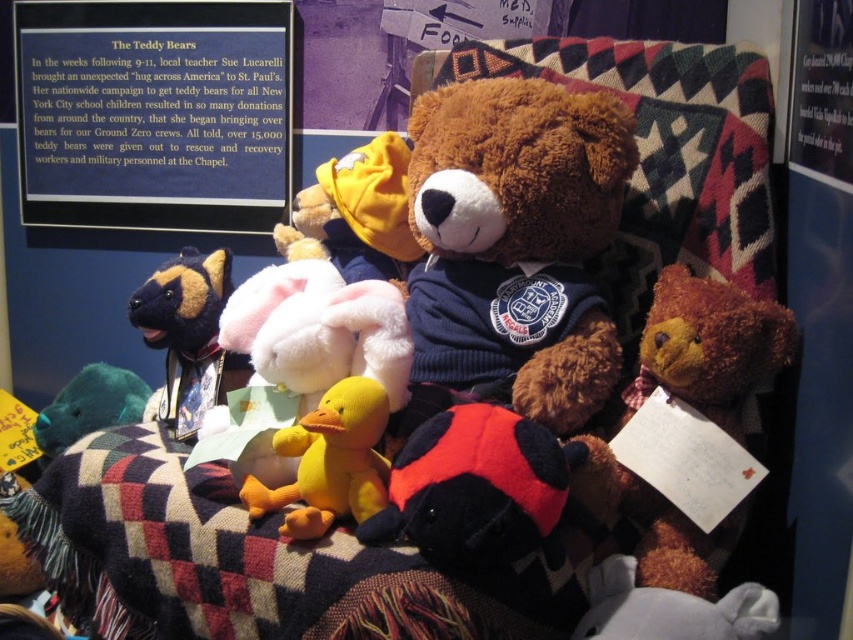
You are standing in front of a display of stuffed toys on a patterned blanket. You see the soft brown teddy bear at center. If you want to take a photo of it with your phone, which is 0.3 feet wide, will the teddy bear fit entirely in your phone camera frame?

The soft brown teddy bear at center and camera are 3.39 feet apart. Since the phone camera frame width is 0.3 feet, the distance between them is sufficient for the teddy bear to fit entirely within the frame.

You are organizing a toy store display and need to place two teddy bears in a specific arrangement. The soft brown teddy bear at center and the fuzzy brown teddy bear at center are both part of this display. According to the image, which teddy bear is located to the left of the other?

The soft brown teddy bear at center is positioned on the left side of fuzzy brown teddy bear at center, so the soft brown teddy bear at center is to the left of the fuzzy brown teddy bear at center.